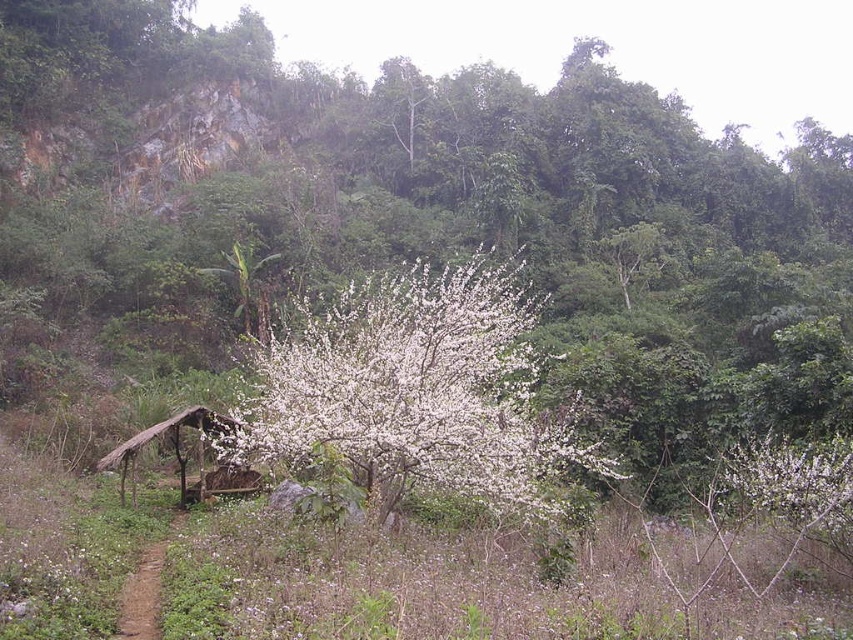
You are standing in the natural landscape and want to take a photo of the thatched wood hut at center without the white fluffy blossoms at center blocking the view. Is the hut visible from your current position?

The white fluffy blossoms at center is located above the thatched wood hut at center, so the blossoms might block the view of the hut. Move to a position where you can look up or move the camera angle downward to see the hut below the blossoms.

You are standing in the serene landscape and want to move from point A to point B. Point A is at coordinates point (254, 360) and point B is at point (125, 449). Which point is closer to you?

Point A at coordinates point (254, 360) is closer to you because it is further to the viewer than point B at point (125, 449).

Based on the photo, you are planning to place a small bench between the white fluffy blossoms at center and the thatched wood hut at center. Given their widths, which object will allow more space on its side for the bench?

The white fluffy blossoms at center have a greater width than the thatched wood hut at center, so placing the bench on the side of the white fluffy blossoms at center would provide more space.